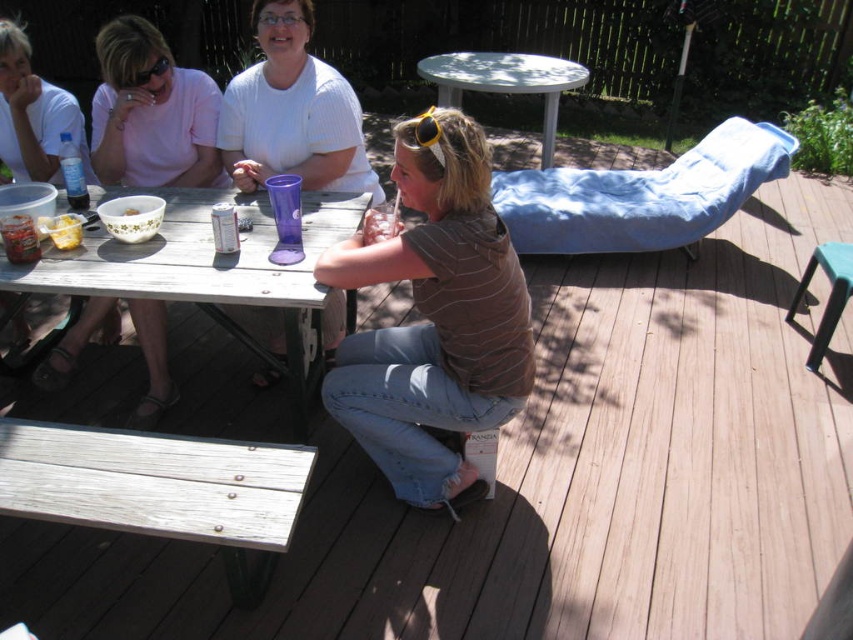
Question: Which of the following is the farthest from the observer?

Choices:
 (A) brown striped shirt at center
 (B) pink fabric shirt at upper left

Answer: (B)

Question: Which of the following is the closest to the observer?

Choices:
 (A) (49, 221)
 (B) (715, 182)
 (C) (432, 128)

Answer: (C)

Question: Can you confirm if white cotton shirt at upper center is wider than clear plastic goggles at upper center?

Choices:
 (A) no
 (B) yes

Answer: (B)

Question: Does brown striped shirt at center appear under wooden picnic table at lower left?

Choices:
 (A) no
 (B) yes

Answer: (B)

Question: Which of the following is the closest to the observer?

Choices:
 (A) (265, 8)
 (B) (161, 177)
 (C) (108, 250)
 (D) (734, 173)

Answer: (C)

Question: Is wooden picnic table at lower left to the left of blue fabric chaise at right from the viewer's perspective?

Choices:
 (A) no
 (B) yes

Answer: (B)